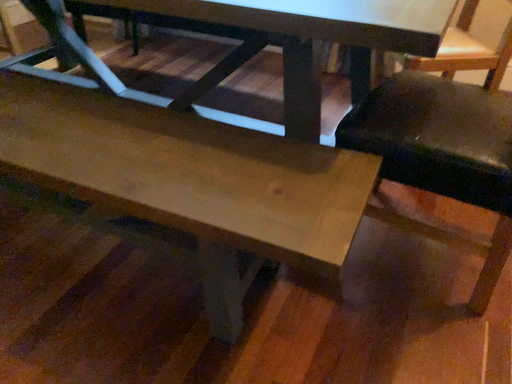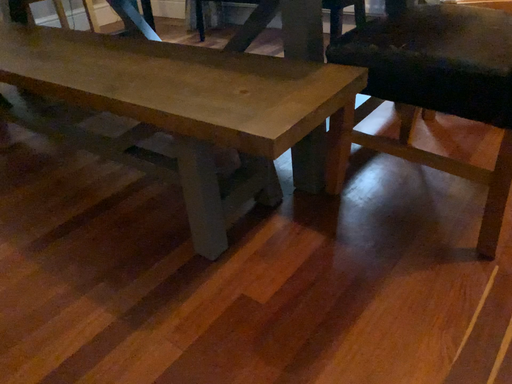
Question: Which way did the camera rotate in the video?

Choices:
 (A) rotated left
 (B) rotated right

Answer: (A)